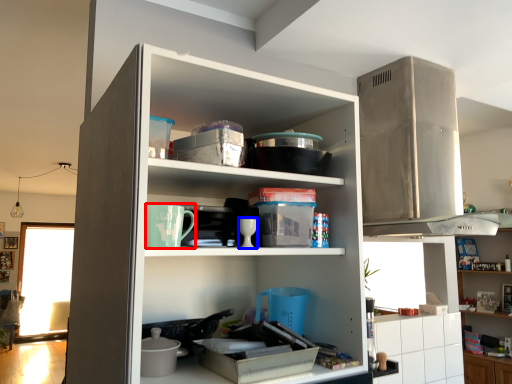
Question: Which point is closer to the camera, appliance (highlighted by a red box) or tableware (highlighted by a blue box)?

Choices:
 (A) appliance
 (B) tableware

Answer: (A)